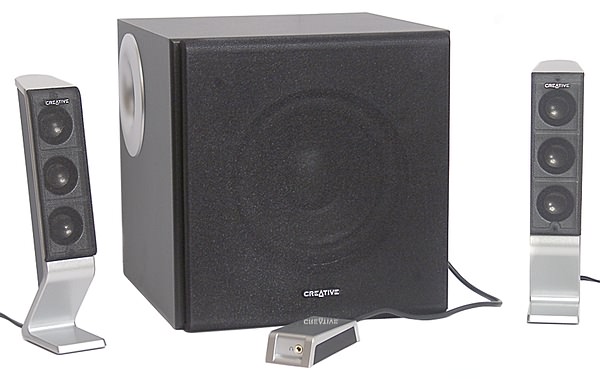
Where is `3 black cords`? 3 black cords is located at coordinates (477, 311), (587, 278), (10, 321).